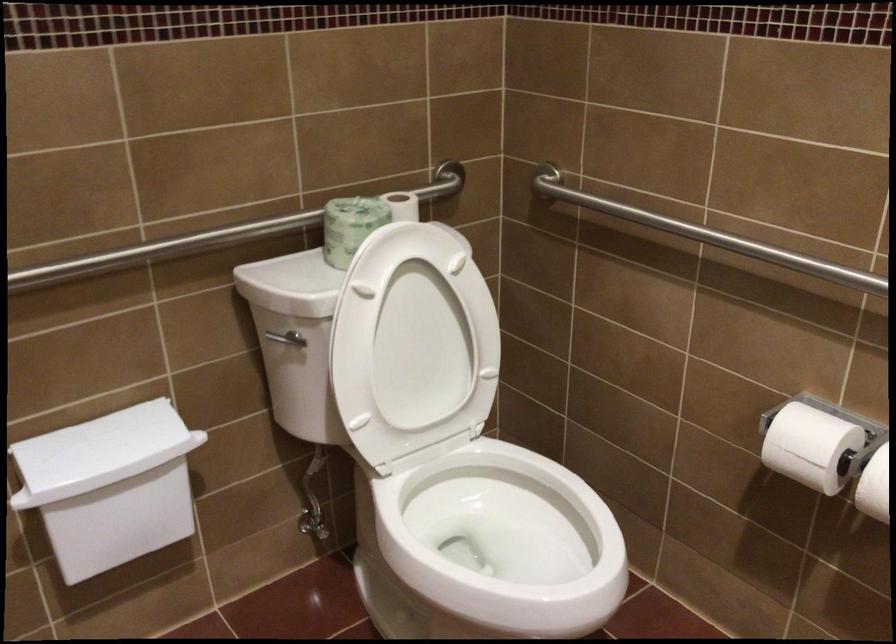
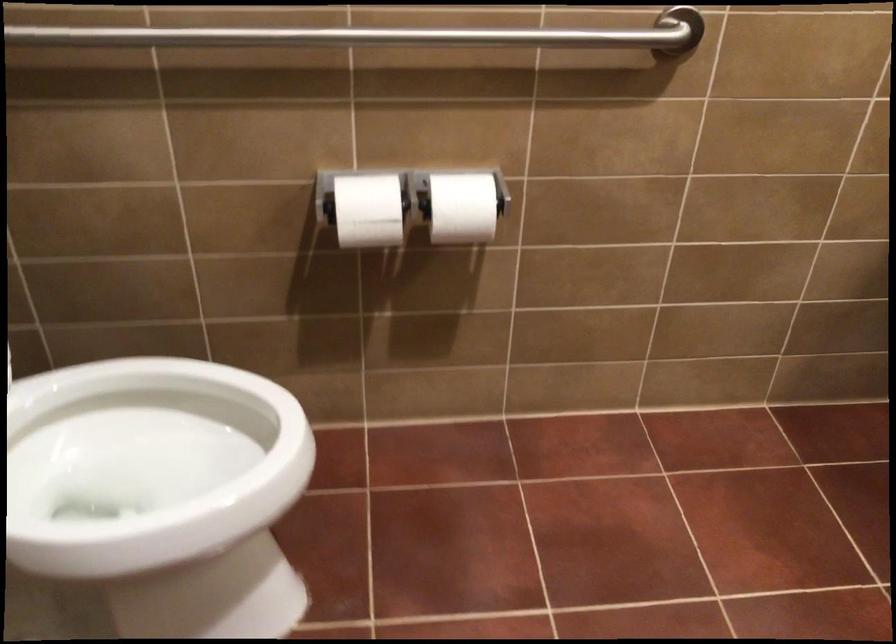
Find the pixel in the second image that matches point 520,538 in the first image.

(147, 464)